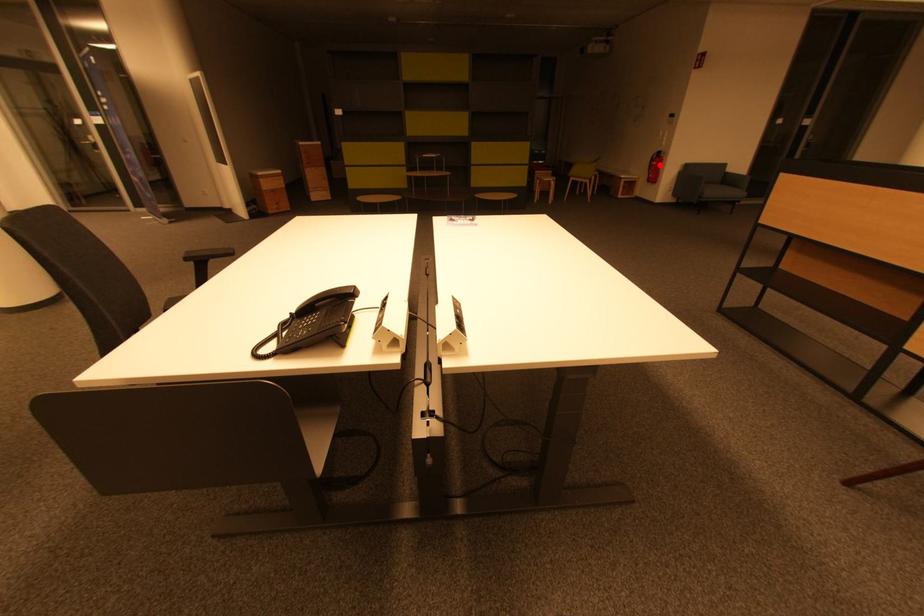
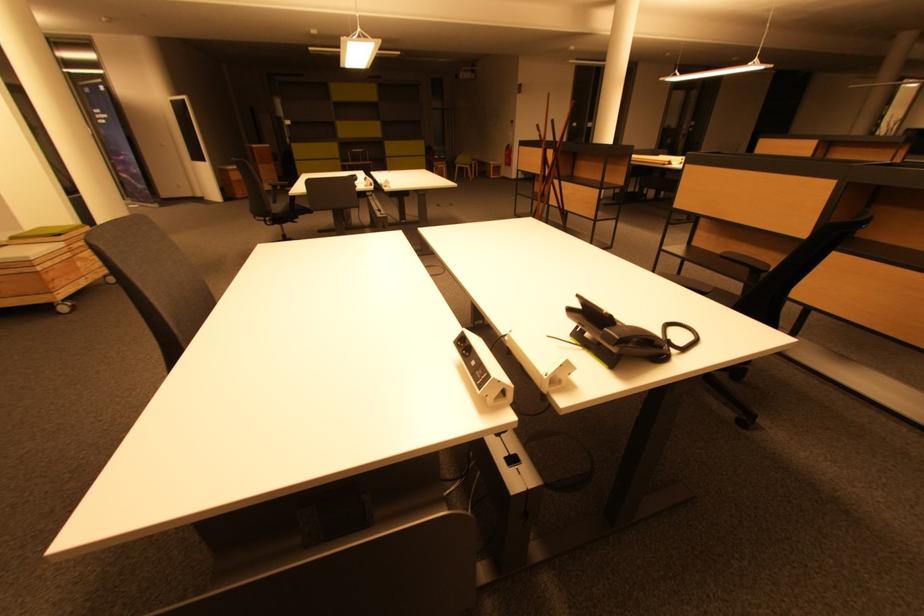
Question: I am providing you with two images of the same scene from different viewpoints. A red point is shown in image1. For the corresponding object point in image2, is it positioned nearer or farther from the camera?

Choices:
 (A) Nearer
 (B) Farther

Answer: (A)